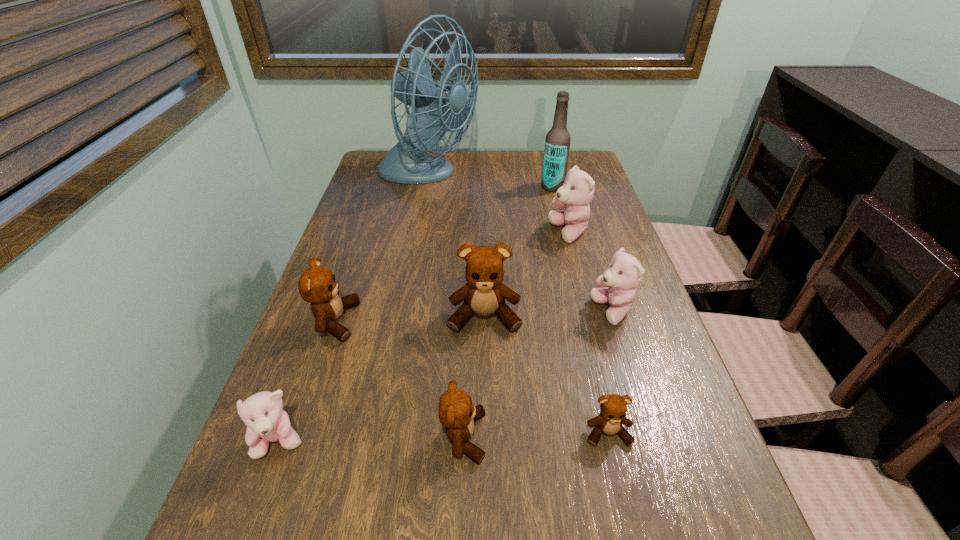
The image size is (960, 540). Find the location of `the smallest brown teddy bear`. the smallest brown teddy bear is located at coordinates (613, 407).

The width and height of the screenshot is (960, 540). In order to click on the shortest teddy bear in this screenshot , I will do `click(613, 407)`.

The height and width of the screenshot is (540, 960). What are the coordinates of `vacant point located 0.380m in front of the fan to blow air` in the screenshot? It's located at (596, 177).

Image resolution: width=960 pixels, height=540 pixels. What are the coordinates of `vacant space located 0.300m on the label of the eighth shortest object` in the screenshot? It's located at (444, 187).

What are the coordinates of `free space located on the label of the eighth shortest object` in the screenshot? It's located at (506, 187).

Where is `free space located 0.120m on the label of the eighth shortest object`? This screenshot has width=960, height=540. free space located 0.120m on the label of the eighth shortest object is located at coordinates (502, 187).

This screenshot has height=540, width=960. In order to click on free space located 0.060m at the face of the biggest pink teddy bear in this screenshot , I will do `click(526, 233)`.

You are a GUI agent. You are given a task and a screenshot of the screen. Output one action in this format:
    pyautogui.click(x=<x>, y=<y>)
    Task: Click on the free space located at the face of the biggest pink teddy bear
    Image resolution: width=960 pixels, height=540 pixels.
    Given the screenshot: What is the action you would take?
    pyautogui.click(x=422, y=233)

Find the location of a particular element. vacant space positioned at the face of the biggest pink teddy bear is located at coordinates (415, 233).

Identify the location of free region located 0.090m on the front-facing side of the biggest brown teddy bear. Image resolution: width=960 pixels, height=540 pixels. [x=485, y=371].